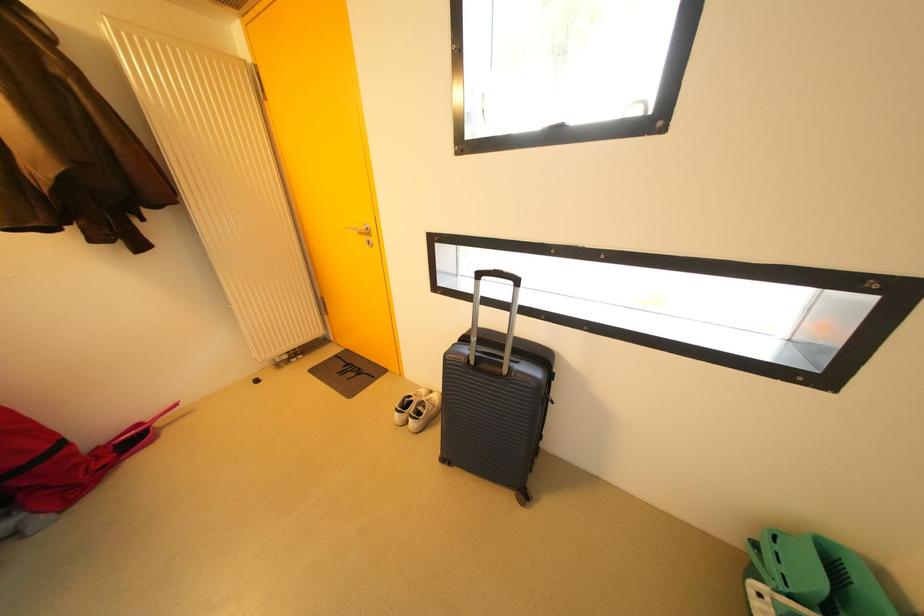
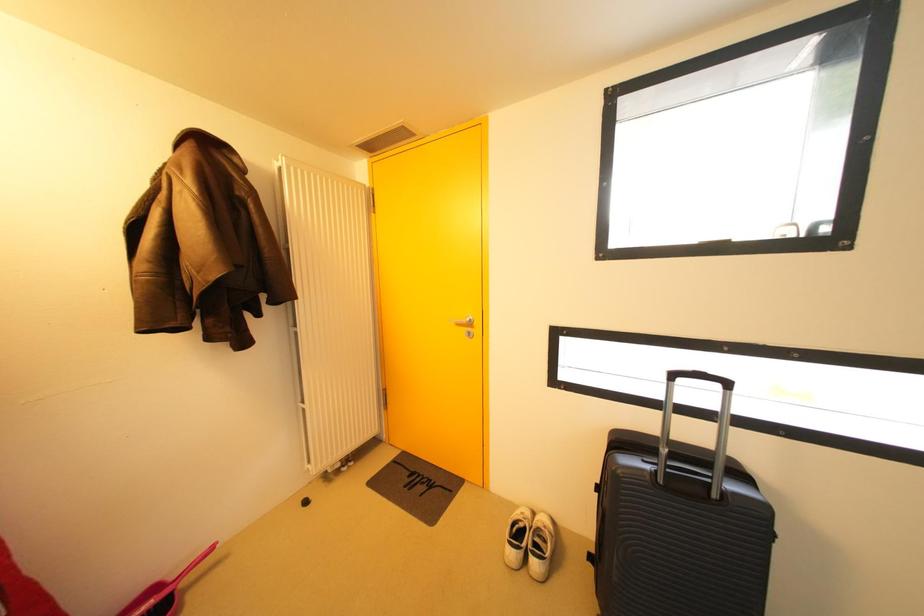
Question: How did the camera likely rotate?

Choices:
 (A) Left
 (B) Right
 (C) Up
 (D) Down

Answer: (C)